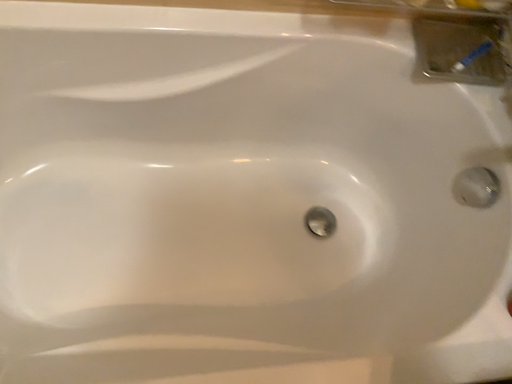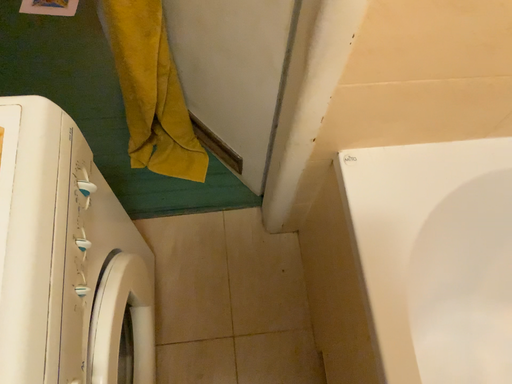
Question: How did the camera likely rotate when shooting the video?

Choices:
 (A) rotated upward
 (B) rotated downward

Answer: (A)